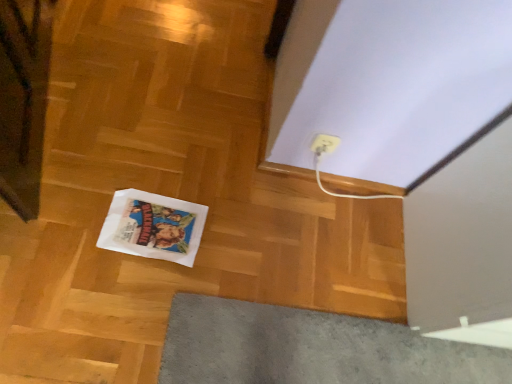
Consider the image. What is the approximate height of gray carpet at lower center?

gray carpet at lower center is 2.97 inches tall.

Locate an element on the screen. gray carpet at lower center is located at coordinates (311, 348).

What is the approximate width of gray carpet at lower center?

gray carpet at lower center is 26.59 centimeters wide.

The image size is (512, 384). Describe the element at coordinates (311, 348) in the screenshot. I see `gray carpet at lower center` at that location.

Image resolution: width=512 pixels, height=384 pixels. Identify the location of gray carpet at lower center. (311, 348).